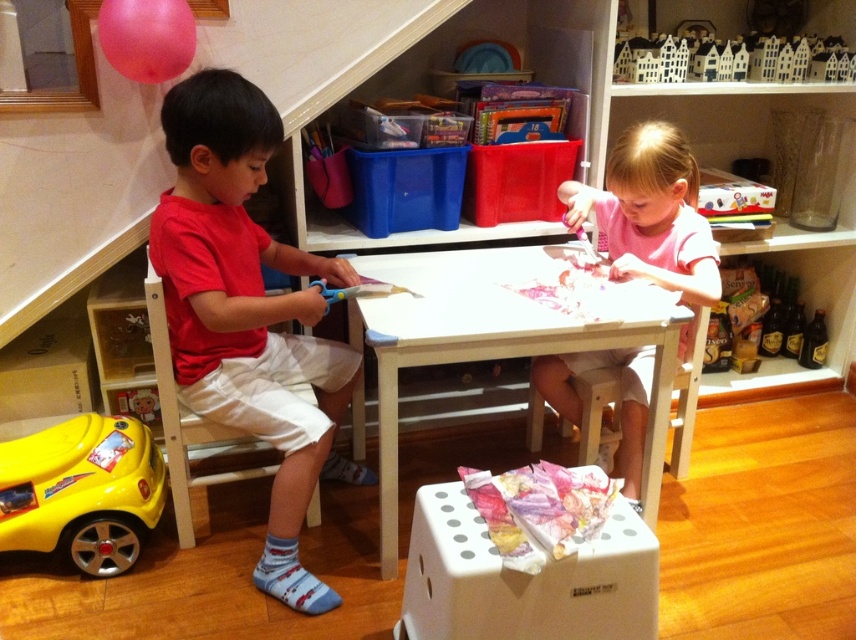
Question: Does pink cotton shirt at center have a greater width compared to white matte wooden houses at upper center?

Choices:
 (A) yes
 (B) no

Answer: (B)

Question: Considering the relative positions of pink cotton shirt at center and pink rubber balloon at upper left in the image provided, where is pink cotton shirt at center located with respect to pink rubber balloon at upper left?

Choices:
 (A) right
 (B) left

Answer: (A)

Question: Is pink cotton shirt at center bigger than yellow plastic toy car at lower left?

Choices:
 (A) no
 (B) yes

Answer: (B)

Question: Which object is farther from the camera taking this photo?

Choices:
 (A) yellow plastic toy car at lower left
 (B) white matte wooden houses at upper center
 (C) white wooden table at center

Answer: (B)

Question: Among these objects, which one is farthest from the camera?

Choices:
 (A) white wooden table at center
 (B) pink rubber balloon at upper left

Answer: (A)

Question: Among these objects, which one is nearest to the camera?

Choices:
 (A) red matte shirt at left
 (B) pink rubber balloon at upper left

Answer: (A)